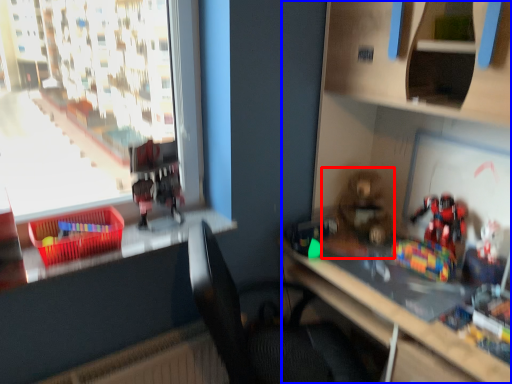
Question: Which object is further to the camera taking this photo, toy (highlighted by a red box) or bookshelf (highlighted by a blue box)?

Choices:
 (A) toy
 (B) bookshelf

Answer: (A)